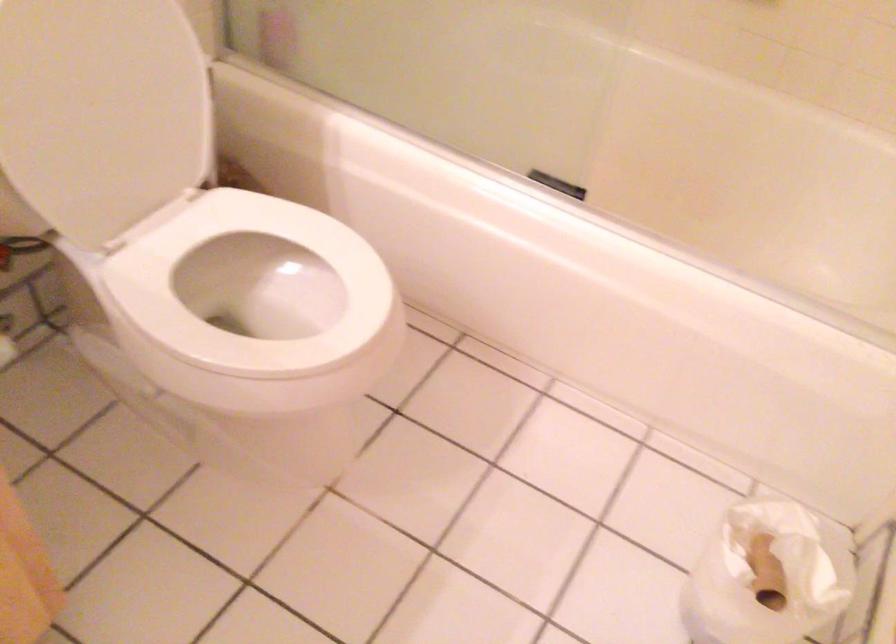
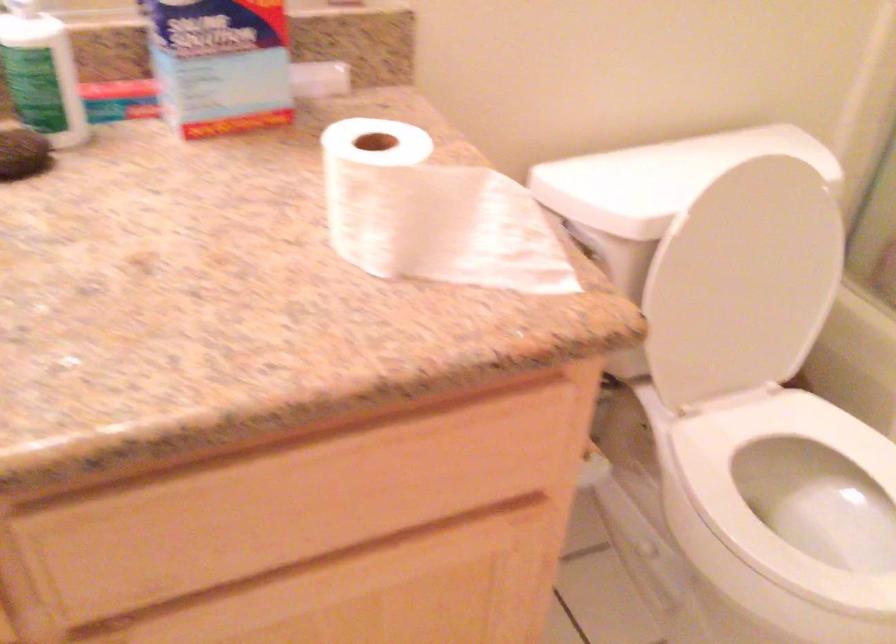
Question: How did the camera likely rotate?

Choices:
 (A) Left
 (B) Right
 (C) Up
 (D) Down

Answer: (A)